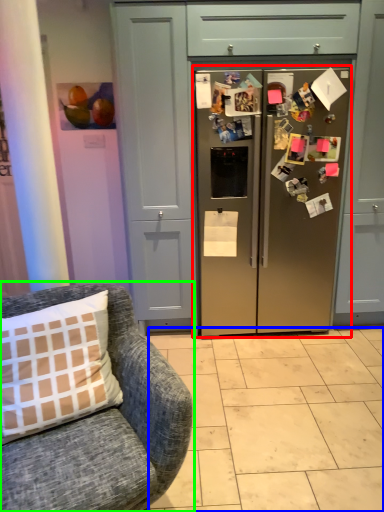
Question: Which object is positioned closest to refrigerator (highlighted by a red box)? Select from tile (highlighted by a blue box) and chair (highlighted by a green box).

Choices:
 (A) tile
 (B) chair

Answer: (A)